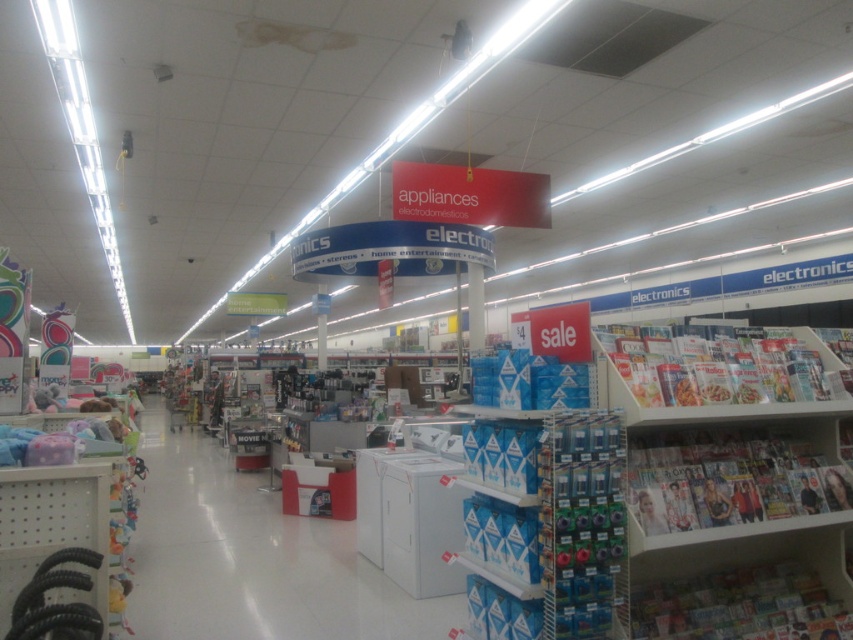
Does point (247, 598) come farther from viewer compared to point (665, 468)?

Yes, point (247, 598) is behind point (665, 468).

Which is below, white glossy appliance at center or white glossy magazine rack at lower right?

white glossy appliance at center

Which is in front, point (293, 547) or point (781, 476)?

Positioned in front is point (781, 476).

The height and width of the screenshot is (640, 853). Identify the location of white glossy appliance at center. (252, 557).

What do you see at coordinates (730, 481) in the screenshot? I see `white glossy magazine rack at lower right` at bounding box center [730, 481].

From the picture: Does white glossy magazine rack at lower right have a greater height compared to white plastic magazine rack at right?

Incorrect, white glossy magazine rack at lower right's height is not larger of white plastic magazine rack at right's.

Find the location of `white glossy magazine rack at lower right`. white glossy magazine rack at lower right is located at coordinates (730, 481).

Does white glossy appliance at center appear on the left side of white plastic magazine rack at right?

Indeed, white glossy appliance at center is positioned on the left side of white plastic magazine rack at right.

Between white glossy appliance at center and white plastic magazine rack at right, which one is positioned lower?

white glossy appliance at center

Is point (286, 604) farther from viewer compared to point (810, 346)?

Yes, it is.

Identify the location of white glossy appliance at center. (252, 557).